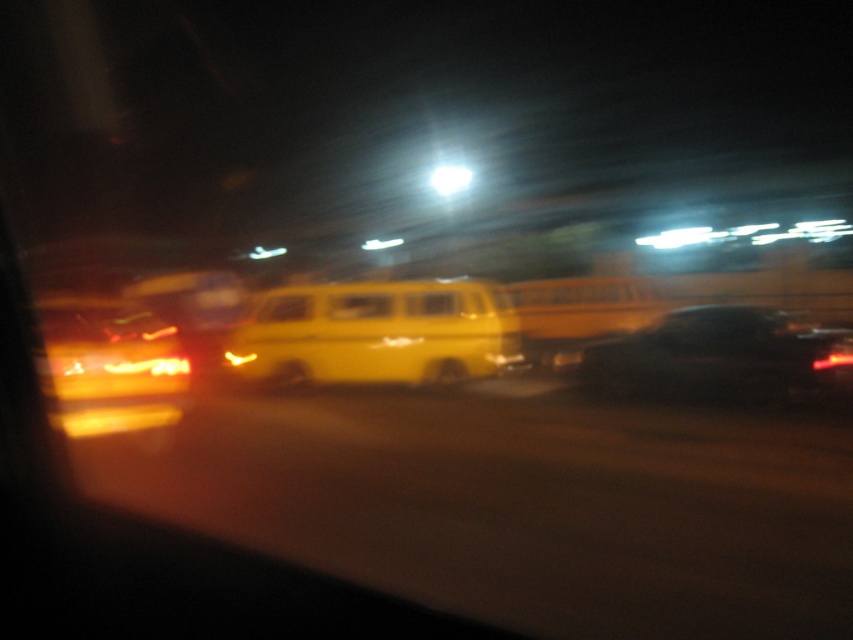
Does black glossy car at right have a greater height compared to matte yellow van at center?

No.

The width and height of the screenshot is (853, 640). What do you see at coordinates (720, 358) in the screenshot? I see `black glossy car at right` at bounding box center [720, 358].

Who is more forward, (824,369) or (120,301)?

Point (120,301)

Where is `black glossy car at right`? black glossy car at right is located at coordinates (720, 358).

Is yellow matte van at center above matte yellow van at center?

Incorrect, yellow matte van at center is not positioned above matte yellow van at center.

Is point (368, 292) closer to viewer compared to point (126, 428)?

No.

Between point (453, 294) and point (93, 365), which one is positioned in front?

Positioned in front is point (93, 365).

Identify the location of yellow matte van at center. (375, 333).

Is point (466, 284) closer to viewer compared to point (647, 346)?

No, it is not.

Does point (337, 380) come behind point (809, 339)?

Yes.

Does point (491, 360) lie in front of point (650, 374)?

No, (491, 360) is further to viewer.

Identify the location of yellow matte van at center. pyautogui.click(x=375, y=333).